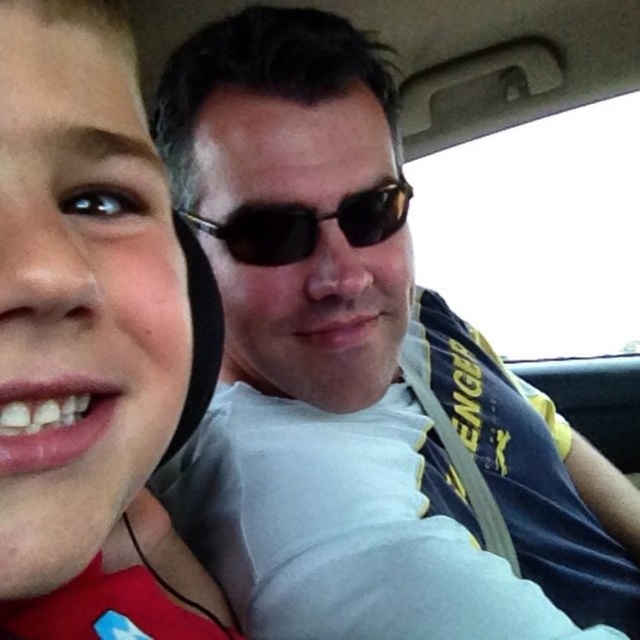
Which of these two, matte black hoodie at left or black plastic sunglasses at center, stands taller?

matte black hoodie at left

Which is below, matte black hoodie at left or black plastic sunglasses at center?

matte black hoodie at left

Between point (8, 522) and point (372, 202), which one is positioned behind?

The point (372, 202) is more distant.

At what (x,y) coordinates should I click in order to perform the action: click on matte black hoodie at left. Please return your answer as a coordinate pair (x, y). The width and height of the screenshot is (640, 640). Looking at the image, I should click on (90, 340).